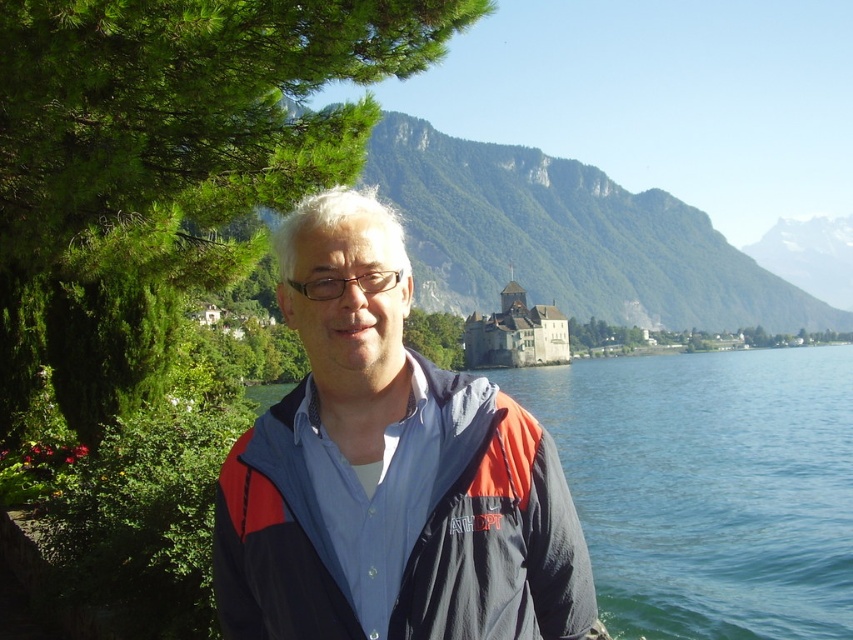
Question: Which of these objects is positioned closest to the blue water at center?

Choices:
 (A) stone castle at center
 (B) green grassy mountain at center

Answer: (A)

Question: Which point is farther to the camera?

Choices:
 (A) blue fabric jacket at center
 (B) green leafy tree at upper left
 (C) green grassy mountain at center

Answer: (C)

Question: Is blue water at center below stone castle at center?

Choices:
 (A) no
 (B) yes

Answer: (B)

Question: Is blue water at center to the left of green grassy mountain at center from the viewer's perspective?

Choices:
 (A) yes
 (B) no

Answer: (A)

Question: Which of these objects is positioned farthest from the green leafy tree at upper left?

Choices:
 (A) stone castle at center
 (B) green grassy mountain at center

Answer: (B)

Question: Does blue water at center appear on the left side of green grassy mountain at center?

Choices:
 (A) yes
 (B) no

Answer: (A)